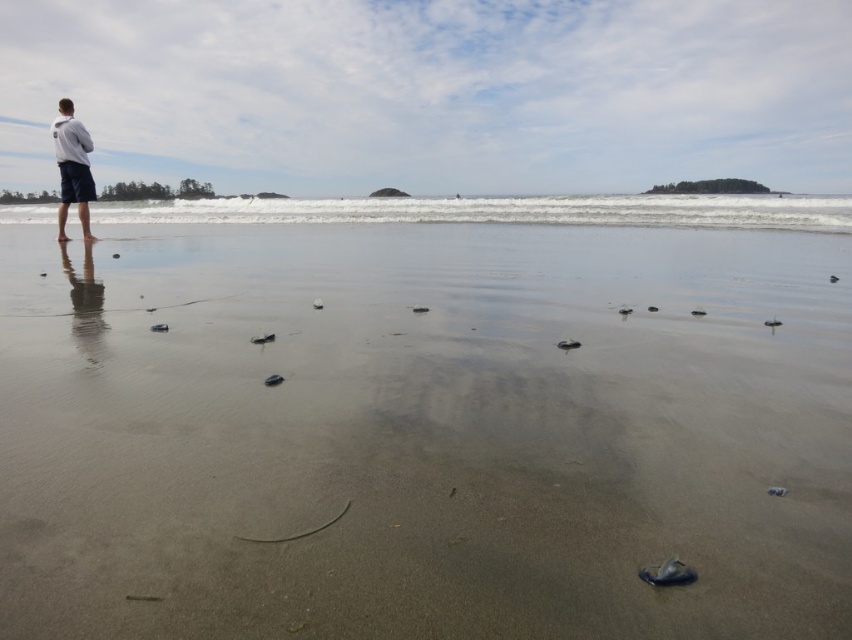
Question: Among these points, which one is farthest from the camera?

Choices:
 (A) (534, 477)
 (B) (84, 145)

Answer: (B)

Question: Which point appears farthest from the camera in this image?

Choices:
 (A) (59, 227)
 (B) (844, 372)

Answer: (A)

Question: Does smooth sand at lower center appear under white matte jacket at upper left?

Choices:
 (A) no
 (B) yes

Answer: (B)

Question: Which point is closer to the camera taking this photo?

Choices:
 (A) (60, 349)
 (B) (82, 227)

Answer: (A)

Question: Is the position of smooth sand at lower center more distant than that of white matte jacket at upper left?

Choices:
 (A) yes
 (B) no

Answer: (B)

Question: Is smooth sand at lower center to the left of white matte jacket at upper left from the viewer's perspective?

Choices:
 (A) no
 (B) yes

Answer: (A)